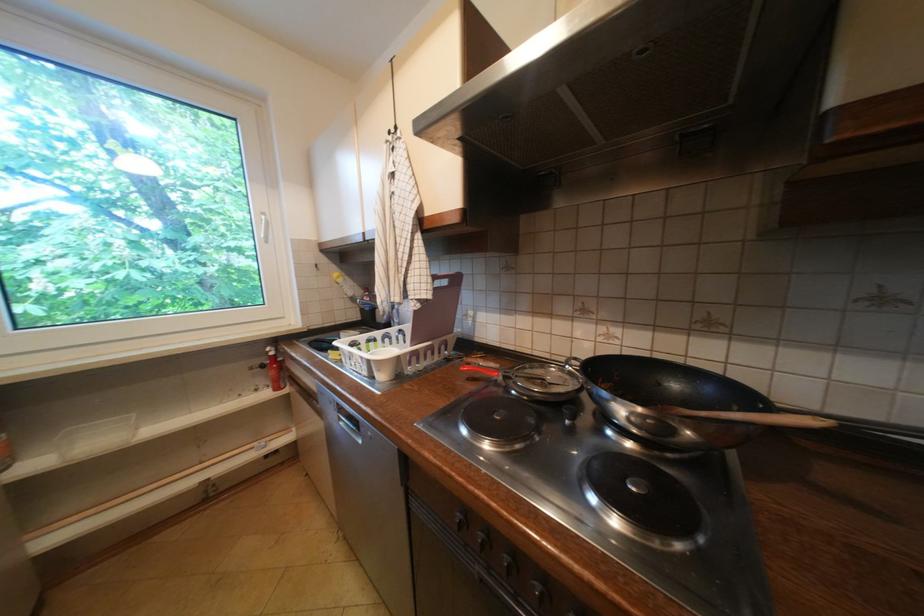
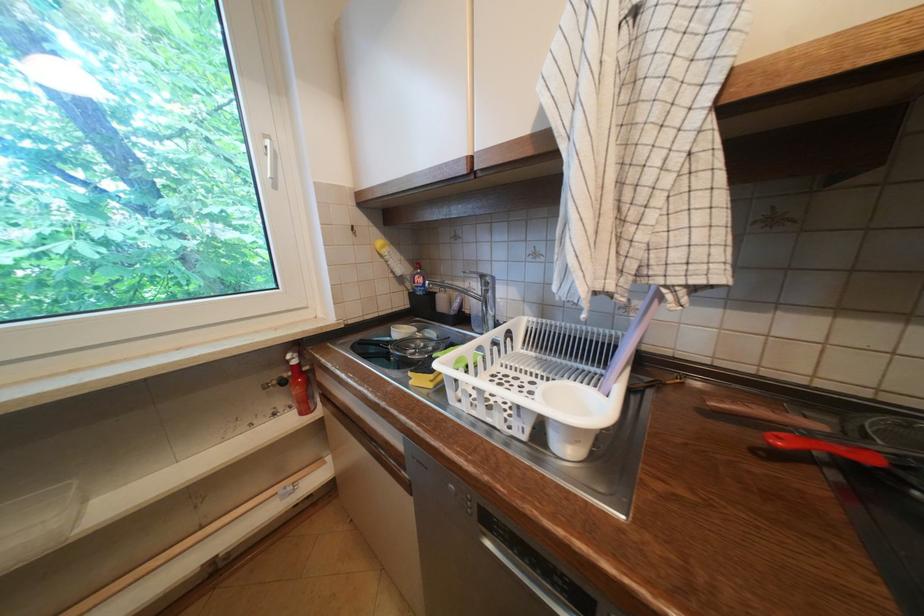
Find the pixel in the second image that matches (348,286) in the first image.

(394, 259)